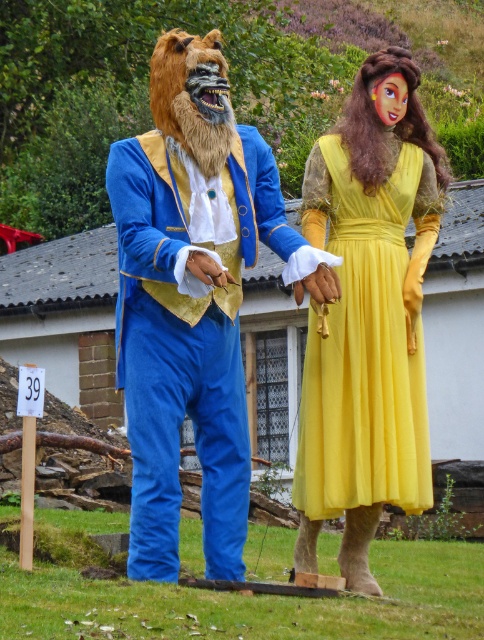
You are a photographer setting up a shoot in the scene. You need to ensure that the velvet blue suit at left is visible in the frame without being blocked by the yellow satin dress at center. Based on their positions, is this possible?

The velvet blue suit at left is positioned over the yellow satin dress at center, meaning it is in front of the dress. Therefore, the velvet blue suit at left will naturally block the view of the yellow satin dress at center, making it impossible to have both fully visible without adjustment.

You are a photographer trying to capture the perfect shot of the two figures in the image. You notice a specific point at coordinates (367, 316). Based on the scene, can you identify which figure this point is located on?

The point at coordinates (367, 316) is on the velvet blue suit at left.